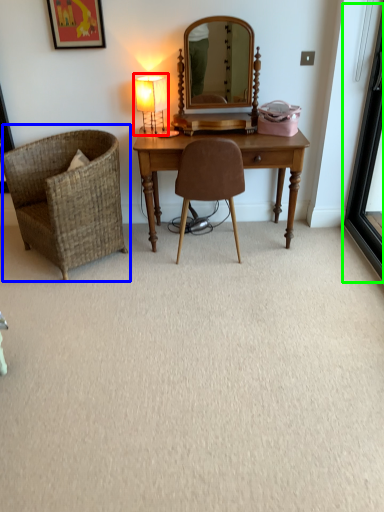
Question: Which object is positioned closest to table lamp (highlighted by a red box)? Select from chair (highlighted by a blue box) and screen door (highlighted by a green box).

Choices:
 (A) chair
 (B) screen door

Answer: (A)